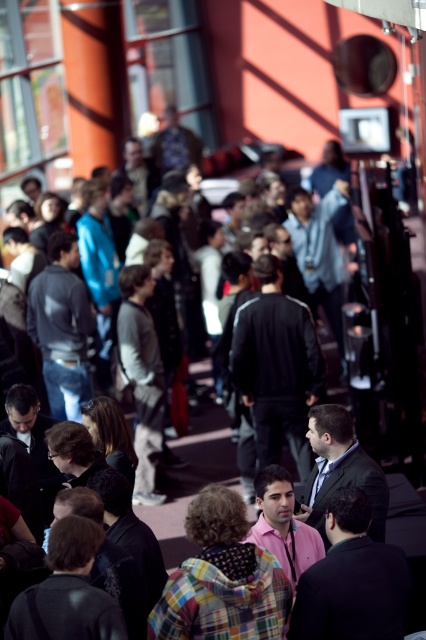
Question: Estimate the real-world distances between objects in this image. Which object is farther from the black matte jacket at center?

Choices:
 (A) dark gray suit at center
 (B) denim jacket at center

Answer: (B)

Question: Which of the following is the farthest from the observer?

Choices:
 (A) (328, 488)
 (B) (241, 332)
 (C) (31, 291)

Answer: (C)

Question: In this image, where is black matte jacket at center located relative to denim jacket at center?

Choices:
 (A) left
 (B) right

Answer: (B)

Question: Which of the following is the farthest from the observer?

Choices:
 (A) denim jacket at center
 (B) black matte jacket at center
 (C) dark gray suit at center

Answer: (A)

Question: Is black matte jacket at center positioned in front of dark gray suit at center?

Choices:
 (A) yes
 (B) no

Answer: (B)

Question: Is black matte jacket at center below denim jacket at center?

Choices:
 (A) no
 (B) yes

Answer: (B)